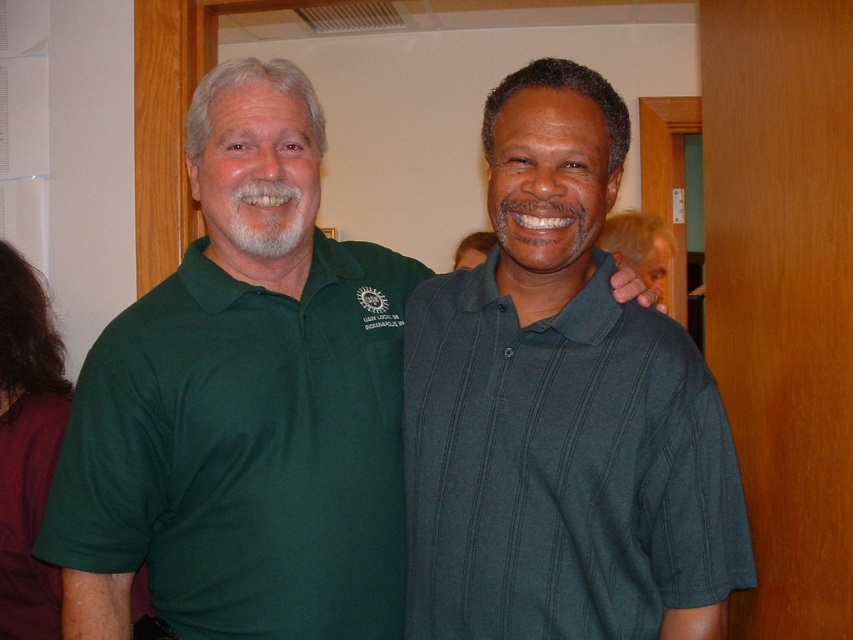
Question: Which object is positioned farthest from the green matte polo shirt at center?

Choices:
 (A) green polo shirt at left
 (B) dark green ribbed polo shirt at center

Answer: (B)

Question: Which point appears closest to the camera in this image?

Choices:
 (A) (196, 170)
 (B) (288, 552)

Answer: (B)

Question: Is green polo shirt at left to the right of dark green ribbed polo shirt at center from the viewer's perspective?

Choices:
 (A) no
 (B) yes

Answer: (A)

Question: Can you confirm if green polo shirt at left is positioned to the left of dark green ribbed polo shirt at center?

Choices:
 (A) yes
 (B) no

Answer: (A)

Question: Considering the relative positions of green polo shirt at left and dark green ribbed polo shirt at center in the image provided, where is green polo shirt at left located with respect to dark green ribbed polo shirt at center?

Choices:
 (A) below
 (B) above

Answer: (B)

Question: Estimate the real-world distances between objects in this image. Which object is closer to the green matte polo shirt at center?

Choices:
 (A) dark green ribbed polo shirt at center
 (B) green polo shirt at left

Answer: (B)